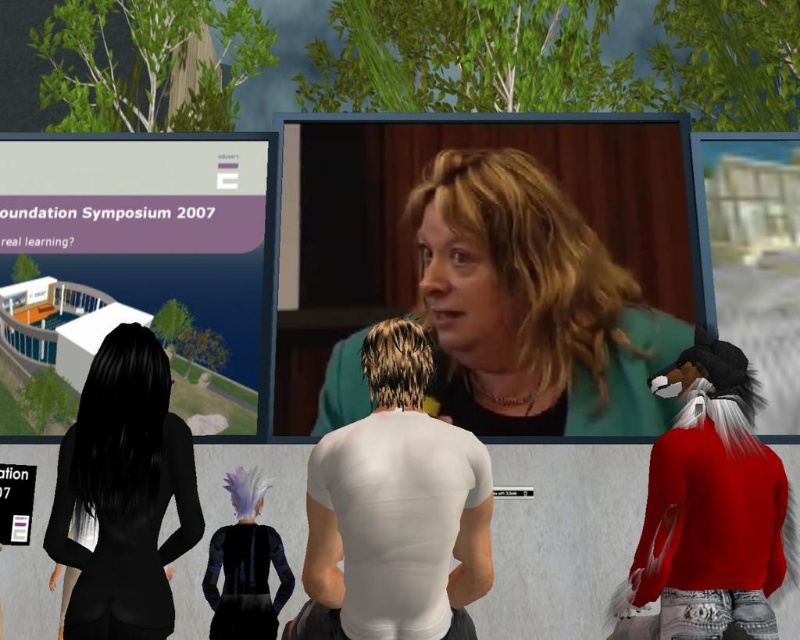
Between point (524, 157) and point (454, 636), which one is positioned behind?

The point (524, 157) is behind.

From the picture: Is teal fabric jacket at center above white matte shirt at center?

Correct, teal fabric jacket at center is located above white matte shirt at center.

Where is `teal fabric jacket at center`? Image resolution: width=800 pixels, height=640 pixels. teal fabric jacket at center is located at coordinates (532, 307).

Does red fuzzy sweater at lower right have a lesser width compared to black matte suit at lower left?

No, red fuzzy sweater at lower right is not thinner than black matte suit at lower left.

Describe the element at coordinates (712, 504) in the screenshot. I see `red fuzzy sweater at lower right` at that location.

This screenshot has height=640, width=800. Find the location of `red fuzzy sweater at lower right`. red fuzzy sweater at lower right is located at coordinates (712, 504).

The height and width of the screenshot is (640, 800). Find the location of `red fuzzy sweater at lower right`. red fuzzy sweater at lower right is located at coordinates (712, 504).

In the scene shown: Is white matte shirt at center wider than red fuzzy sweater at lower right?

Yes.

Is the position of white matte shirt at center less distant than that of red fuzzy sweater at lower right?

Yes, white matte shirt at center is closer to the viewer.

Who is more forward, (x=458, y=452) or (x=744, y=620)?

Point (x=458, y=452) is more forward.

You are a GUI agent. You are given a task and a screenshot of the screen. Output one action in this format:
    pyautogui.click(x=<x>, y=<y>)
    Task: Click on the white matte shirt at center
    The height and width of the screenshot is (640, 800).
    Given the screenshot: What is the action you would take?
    pyautogui.click(x=396, y=509)